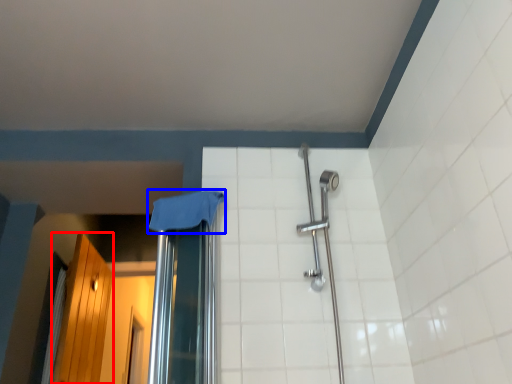
Question: Which object is closer to the camera taking this photo, screen door (highlighted by a red box) or cloth (highlighted by a blue box)?

Choices:
 (A) screen door
 (B) cloth

Answer: (B)